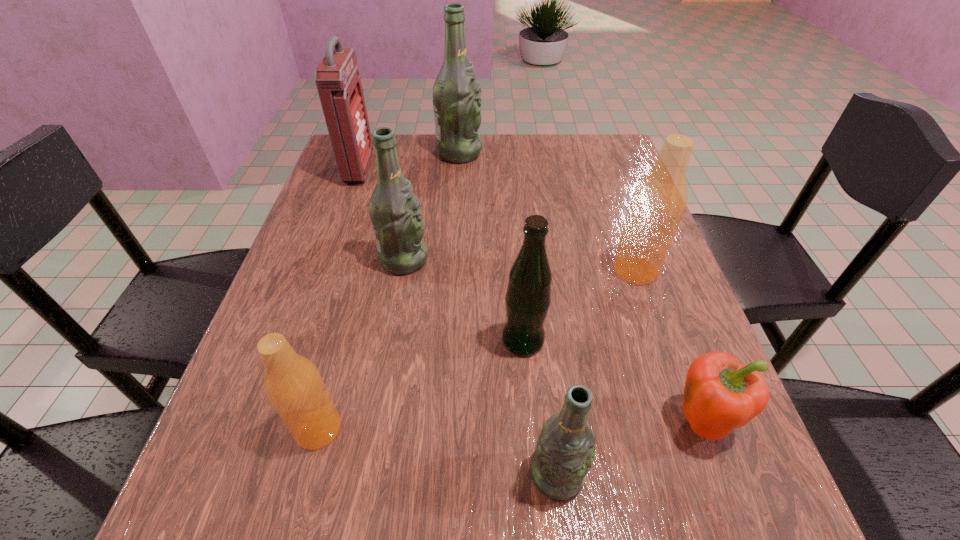
Locate an element on the screen. the biggest green beer bottle is located at coordinates (456, 93).

In order to click on the tallest beer bottle in this screenshot , I will do `click(456, 93)`.

What are the coordinates of `the leftmost object` in the screenshot? It's located at (x=338, y=81).

You are a GUI agent. You are given a task and a screenshot of the screen. Output one action in this format:
    pyautogui.click(x=<x>, y=<y>)
    Task: Click on the first-aid kit
    
    Given the screenshot: What is the action you would take?
    pyautogui.click(x=338, y=81)

At what (x,y) coordinates should I click in order to perform the action: click on the third nearest green beer bottle. Please return your answer as a coordinate pair (x, y). Image resolution: width=960 pixels, height=540 pixels. Looking at the image, I should click on (395, 212).

The height and width of the screenshot is (540, 960). What are the coordinates of `the farther tan beer bottle` in the screenshot? It's located at (658, 203).

Identify the location of the right tan beer bottle. The image size is (960, 540). (658, 203).

The width and height of the screenshot is (960, 540). Identify the location of the second nearest green beer bottle. (528, 296).

This screenshot has height=540, width=960. I want to click on the fourth farthest beer bottle, so click(528, 296).

This screenshot has height=540, width=960. What are the coordinates of `the smaller tan beer bottle` in the screenshot? It's located at (292, 383).